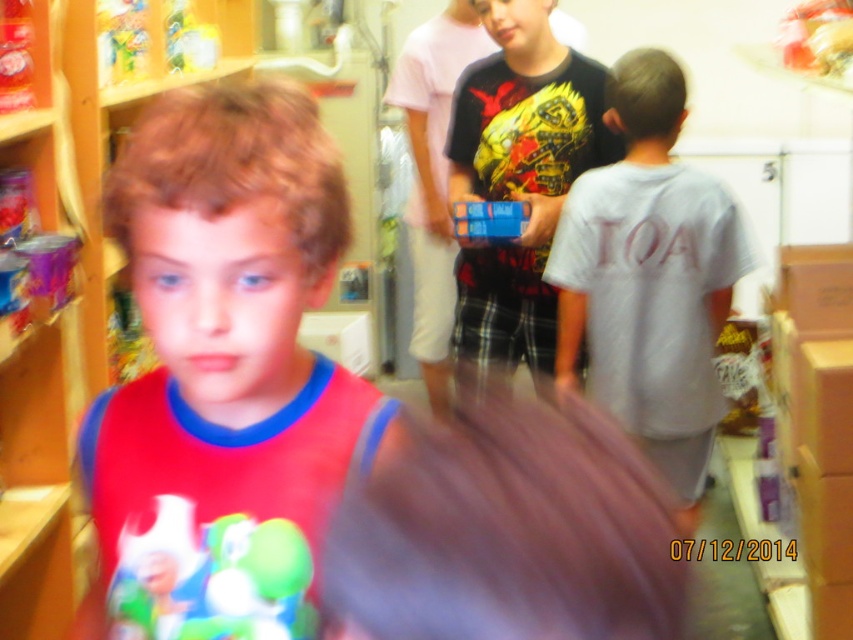
Based on the scene description, where is the gray cotton shirt at right located in terms of its 2D coordinates?

The gray cotton shirt at right is located at the 2D coordinates of point [648,276].

You are trying to hang a picture frame on the wall between the gray cotton shirt at right and the wooden bookshelf at left. Which object is closer to the wall for you to start measuring from?

The wooden bookshelf at left is closer to the wall than the gray cotton shirt at right because the gray cotton shirt at right is shorter than the wooden bookshelf at left.